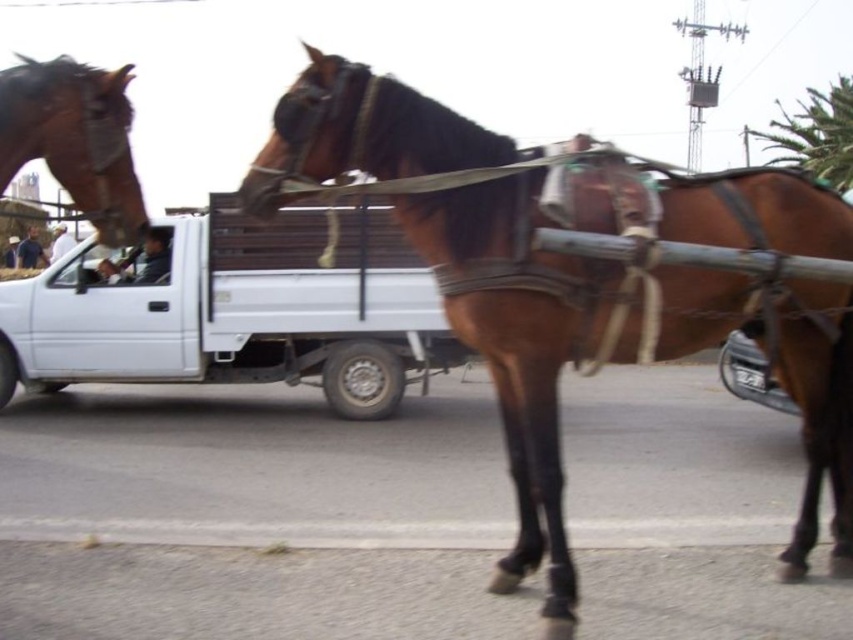
Question: Based on their relative distances, which object is nearer to the brown glossy horse at upper left?

Choices:
 (A) brown glossy horse at center
 (B) white matte truck at center

Answer: (A)

Question: Does white matte truck at center appear over brown glossy horse at upper left?

Choices:
 (A) no
 (B) yes

Answer: (A)

Question: Is brown glossy horse at center below white matte truck at center?

Choices:
 (A) yes
 (B) no

Answer: (A)

Question: Which object is the farthest from the white matte truck at center?

Choices:
 (A) brown glossy horse at center
 (B) brown glossy horse at upper left

Answer: (B)

Question: Which point is closer to the camera?

Choices:
 (A) brown glossy horse at center
 (B) white matte truck at center
 (C) brown glossy horse at upper left

Answer: (C)

Question: Can you confirm if white matte truck at center is thinner than brown glossy horse at upper left?

Choices:
 (A) no
 (B) yes

Answer: (A)